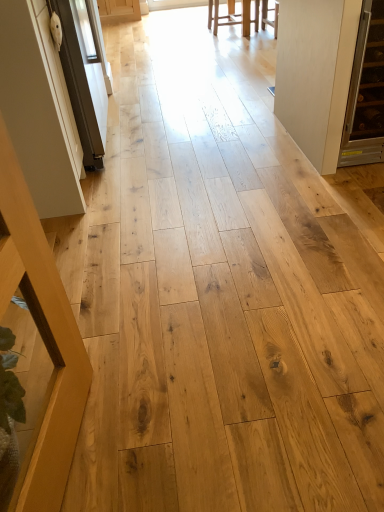
This screenshot has height=512, width=384. I want to click on vacant space underneath natural wood table at left, which is counted as the first furniture, starting from the front (from a real-world perspective), so click(x=83, y=443).